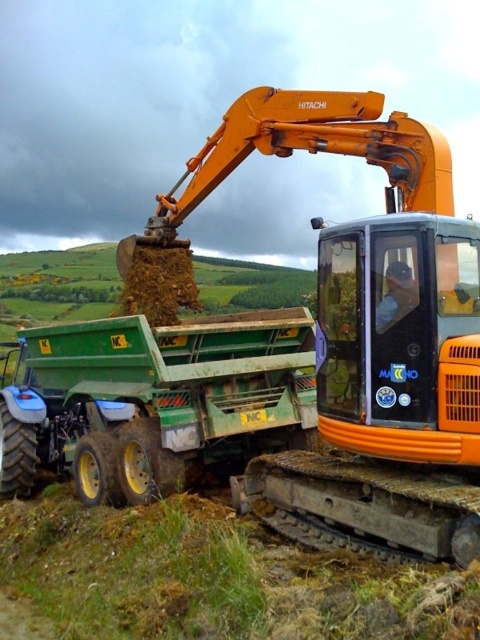
Is point (444, 220) positioned in front of point (147, 371)?

Yes, it is.

Between point (357, 304) and point (75, 358), which one is positioned in front?

Positioned in front is point (357, 304).

Does point (206, 189) lie behind point (132, 445)?

Yes, it is.

At what (x,y) coordinates should I click in order to perform the action: click on orange metallic excavator at center. Please return your answer as a coordinate pair (x, y). The image size is (480, 640). Looking at the image, I should click on (357, 332).